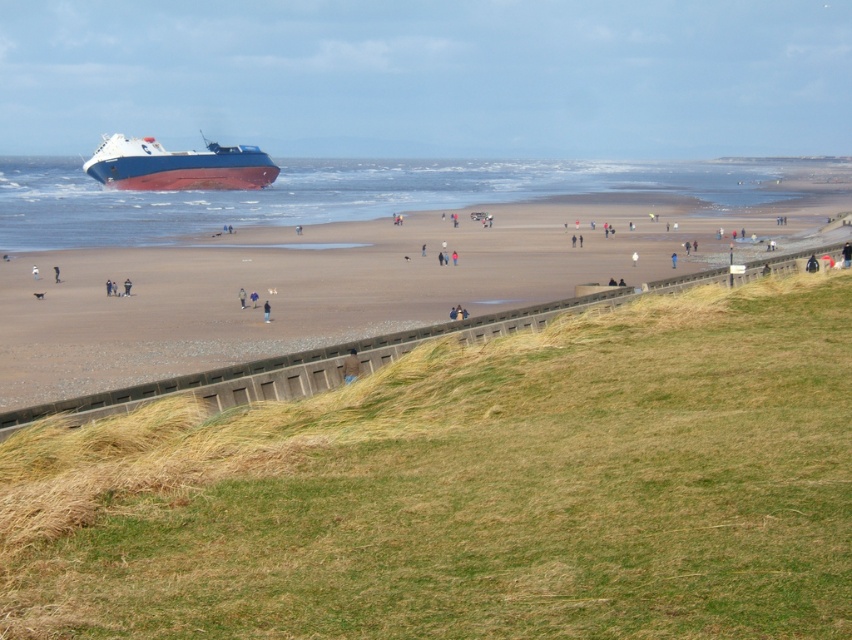
What are the coordinates of the brown sandy beach at upper center?

The coordinates of the brown sandy beach at upper center are (x=326, y=285).

You are standing on the grassy slope looking towards the beach. You see the brown sandy beach at upper center and the brown fuzzy jacket at lower center. Which object is closer to you?

The brown sandy beach at upper center is closer to you because it is in front of the brown fuzzy jacket at lower center.